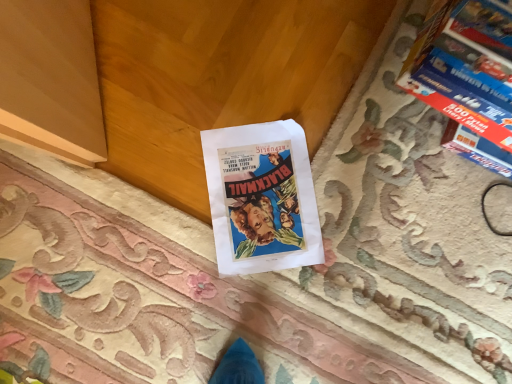
The width and height of the screenshot is (512, 384). I want to click on vacant area that lies to the right of vintage paper poster at center, so 358,268.